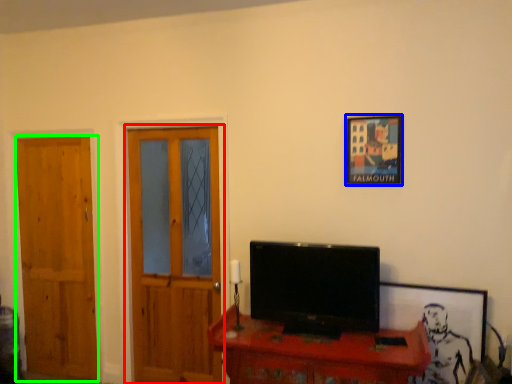
Question: Which object is positioned closest to door (highlighted by a red box)? Select from picture frame (highlighted by a blue box) and door (highlighted by a green box).

Choices:
 (A) picture frame
 (B) door

Answer: (B)